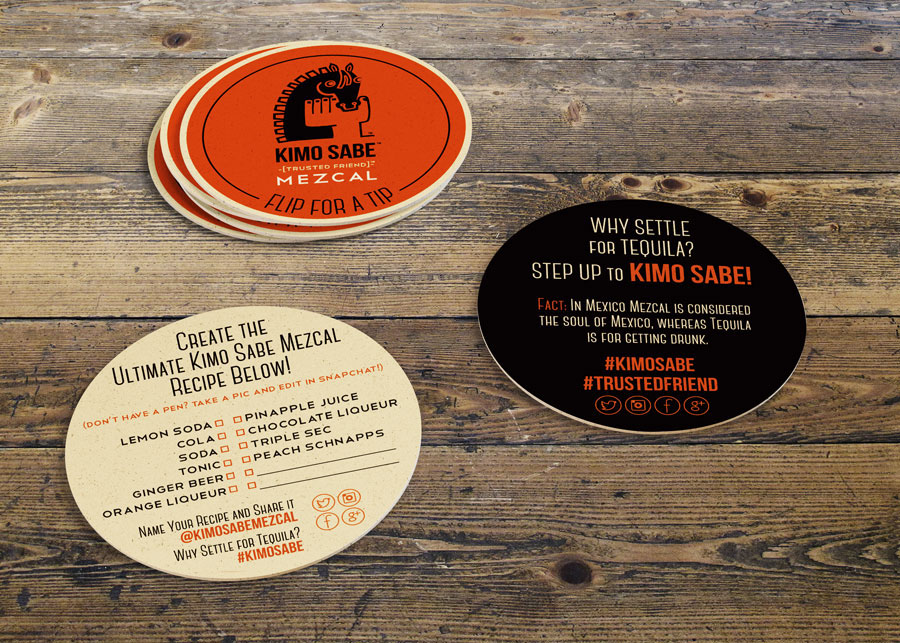
The height and width of the screenshot is (643, 900). Find the location of `background color of lightest color coaster`. background color of lightest color coaster is located at coordinates (380, 484).